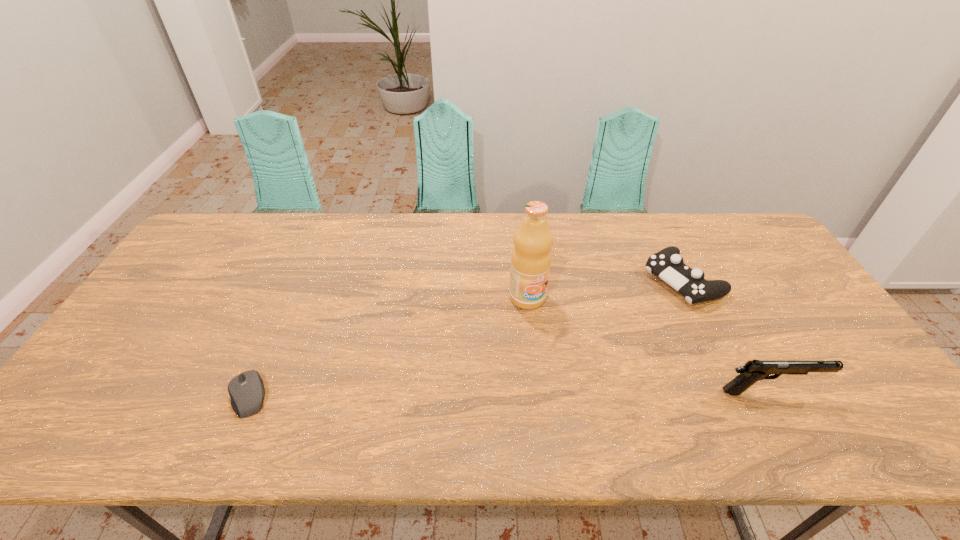
Locate an element on the screen. vacant space that satisfies the following two spatial constraints: 1. on the back side of the leftmost object; 2. at the aiming end of the second tallest object is located at coordinates (251, 392).